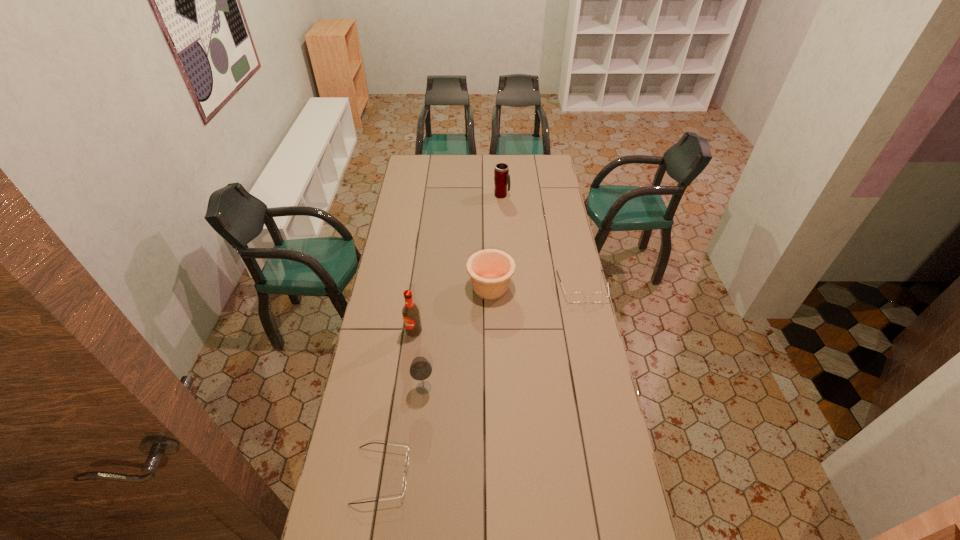
Identify the location of blank space located on the right of the beer bottle. click(478, 331).

The height and width of the screenshot is (540, 960). In order to click on vacant space situated on the side with the handle of the farthest object in this screenshot , I will do `click(552, 195)`.

I want to click on free spot located 0.110m on the back of the pottery, so click(x=490, y=255).

The height and width of the screenshot is (540, 960). I want to click on free location located 0.120m on the back of the wineglass, so click(x=427, y=352).

At what (x,y) coordinates should I click in order to perform the action: click on object at the near edge. Please return your answer as a coordinate pair (x, y). The height and width of the screenshot is (540, 960). Looking at the image, I should click on (407, 453).

Find the location of a particular element. This screenshot has width=960, height=540. spectacles located in the left edge section of the desktop is located at coordinates (407, 453).

Locate an element on the screen. The image size is (960, 540). beer bottle that is at the left edge is located at coordinates (411, 316).

Locate an element on the screen. object situated at the right edge is located at coordinates (575, 297).

Identify the location of object at the near left corner. (407, 453).

The image size is (960, 540). In order to click on free region at the near edge of the desktop in this screenshot , I will do `click(486, 503)`.